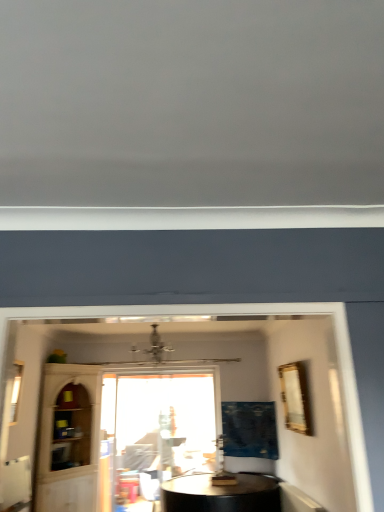
What do you see at coordinates (295, 397) in the screenshot?
I see `gold metallic picture frame at upper right` at bounding box center [295, 397].

Locate an element on the screen. transparent glass window at center, placed as the first window when sorted from bottom to top is located at coordinates (155, 432).

Identify the location of clear glass window at left, which is the second window in bottom-to-top order. (16, 390).

You are a GUI agent. You are given a task and a screenshot of the screen. Output one action in this format:
    pyautogui.click(x=<x>, y=<y>)
    Task: Click on the gold metallic picture frame at upper right
    This screenshot has width=384, height=512.
    Given the screenshot: What is the action you would take?
    pyautogui.click(x=295, y=397)

Is point (223, 442) closer or farther from the camera than point (46, 455)?

Point (223, 442) is positioned farther from the camera compared to point (46, 455).

Locate an element on the screen. curtain below the transparent glass cabinet at lower left (from the image's perspective) is located at coordinates (250, 429).

Measure the distance from blue fabric curtain at center to transparent glass cabinet at lower left.

blue fabric curtain at center and transparent glass cabinet at lower left are 2.05 meters apart.

From a real-world perspective, is blue fabric curtain at center positioned above or below transparent glass cabinet at lower left?

blue fabric curtain at center is above transparent glass cabinet at lower left.

Is blue fabric curtain at center facing towards transparent glass window at center, the second window when ordered from top to bottom?

No, blue fabric curtain at center is not aimed at transparent glass window at center, the second window when ordered from top to bottom.

Between blue fabric curtain at center and transparent glass window at center, which appears as the first window when viewed from the right, which one has larger width?

With larger width is blue fabric curtain at center.

Are blue fabric curtain at center and transparent glass window at center, placed as the first window when sorted from bottom to top, beside each other?

There is a gap between blue fabric curtain at center and transparent glass window at center, placed as the first window when sorted from bottom to top.

Consider the image. Does blue fabric curtain at center have a lesser height compared to transparent glass window at center, which appears as the first window when viewed from the right?

Indeed, blue fabric curtain at center has a lesser height compared to transparent glass window at center, which appears as the first window when viewed from the right.

From a real-world perspective, who is located lower, gold metallic picture frame at upper right or transparent glass window at center, acting as the 1th window starting from the back?

transparent glass window at center, acting as the 1th window starting from the back, is physically lower.

From the picture: Does gold metallic picture frame at upper right have a greater height compared to transparent glass window at center, the second window positioned from the front?

Incorrect, the height of gold metallic picture frame at upper right is not larger of that of transparent glass window at center, the second window positioned from the front.

Choose the correct answer: Is gold metallic picture frame at upper right inside transparent glass window at center, which appears as the first window when viewed from the right, or outside it?

gold metallic picture frame at upper right is outside transparent glass window at center, which appears as the first window when viewed from the right.

Does gold metallic picture frame at upper right have a lesser width compared to transparent glass window at center, the second window viewed from the left?

No, gold metallic picture frame at upper right is not thinner than transparent glass window at center, the second window viewed from the left.

Are transparent glass window at center, which appears as the first window when viewed from the right, and clear glass window at left, which is the 1th window from front to back, located far from each other?

transparent glass window at center, which appears as the first window when viewed from the right, is far away from clear glass window at left, which is the 1th window from front to back.

Does transparent glass window at center, the second window positioned from the front, have a larger size compared to clear glass window at left, the 2th window viewed from the right?

Yes, transparent glass window at center, the second window positioned from the front, is bigger than clear glass window at left, the 2th window viewed from the right.

In terms of width, does transparent glass window at center, which appears as the first window when viewed from the right, look wider or thinner when compared to clear glass window at left, which is the first window in left-to-right order?

In the image, transparent glass window at center, which appears as the first window when viewed from the right, appears to be more narrow than clear glass window at left, which is the first window in left-to-right order.

Considering the sizes of objects transparent glass cabinet at lower left and blue fabric curtain at center in the image provided, who is thinner, transparent glass cabinet at lower left or blue fabric curtain at center?

With smaller width is transparent glass cabinet at lower left.

Image resolution: width=384 pixels, height=512 pixels. I want to click on curtain on the right of transparent glass cabinet at lower left, so click(x=250, y=429).

Does transparent glass cabinet at lower left appear on the right side of blue fabric curtain at center?

Incorrect, transparent glass cabinet at lower left is not on the right side of blue fabric curtain at center.

Could you tell me if transparent glass window at center, placed as the first window when sorted from bottom to top, is turned towards blue fabric curtain at center?

No, transparent glass window at center, placed as the first window when sorted from bottom to top, does not turn towards blue fabric curtain at center.

Considering the points (175, 467) and (241, 406), which point is behind, point (175, 467) or point (241, 406)?

The point (175, 467) is behind.

From the image's perspective, between transparent glass window at center, which appears as the first window when viewed from the right, and gold metallic picture frame at upper right, which one is located above?

gold metallic picture frame at upper right is shown above in the image.

Is transparent glass window at center, the second window positioned from the front, far from gold metallic picture frame at upper right?

Absolutely, transparent glass window at center, the second window positioned from the front, is distant from gold metallic picture frame at upper right.

Considering the relative positions of transparent glass window at center, which appears as the first window when viewed from the right, and gold metallic picture frame at upper right in the image provided, is transparent glass window at center, which appears as the first window when viewed from the right, to the right of gold metallic picture frame at upper right from the viewer's perspective?

In fact, transparent glass window at center, which appears as the first window when viewed from the right, is to the left of gold metallic picture frame at upper right.

Could you measure the distance between transparent glass window at center, acting as the 1th window starting from the back, and gold metallic picture frame at upper right?

They are 2.19 meters apart.

Identify the location of curtain on the right of transparent glass cabinet at lower left. This screenshot has width=384, height=512. (250, 429).

Identify the location of window behind the blue fabric curtain at center. This screenshot has height=512, width=384. (155, 432).

Estimate the real-world distances between objects in this image. Which object is closer to gold metallic picture frame at upper right, blue fabric curtain at center or transparent glass window at center, which appears as the first window when viewed from the right?

The object closer to gold metallic picture frame at upper right is blue fabric curtain at center.

From the picture: Looking at the image, which one is located further to clear glass window at left, the 2th window positioned from the back, transparent glass cabinet at lower left or blue fabric curtain at center?

blue fabric curtain at center is positioned further to the anchor clear glass window at left, the 2th window positioned from the back.

Estimate the real-world distances between objects in this image. Which object is further from transparent glass window at center, placed as the first window when sorted from bottom to top, blue fabric curtain at center or clear glass window at left, the 1th window in the top-to-bottom sequence?

clear glass window at left, the 1th window in the top-to-bottom sequence, is further to transparent glass window at center, placed as the first window when sorted from bottom to top.

Consider the image. Looking at the image, which one is located closer to blue fabric curtain at center, clear glass window at left, the 2th window positioned from the back, or transparent glass window at center, which appears as the first window when viewed from the right?

transparent glass window at center, which appears as the first window when viewed from the right.

Which object lies nearer to the anchor point transparent glass cabinet at lower left, gold metallic picture frame at upper right or clear glass window at left, the 2th window viewed from the right?

gold metallic picture frame at upper right is positioned closer to the anchor transparent glass cabinet at lower left.

When comparing their distances from transparent glass window at center, acting as the 1th window starting from the back, does gold metallic picture frame at upper right or clear glass window at left, which is the first window in left-to-right order, seem further?

clear glass window at left, which is the first window in left-to-right order, lies further to transparent glass window at center, acting as the 1th window starting from the back, than the other object.

When comparing their distances from blue fabric curtain at center, does clear glass window at left, which is the first window in left-to-right order, or gold metallic picture frame at upper right seem closer?

gold metallic picture frame at upper right is positioned closer to the anchor blue fabric curtain at center.

When comparing their distances from gold metallic picture frame at upper right, does clear glass window at left, which is the first window in left-to-right order, or blue fabric curtain at center seem closer?

blue fabric curtain at center is positioned closer to the anchor gold metallic picture frame at upper right.

Find the location of `glass door between clear glass window at left, which is the first window in left-to-right order, and gold metallic picture frame at upper right, in the horizontal direction`. glass door between clear glass window at left, which is the first window in left-to-right order, and gold metallic picture frame at upper right, in the horizontal direction is located at coordinates (69, 439).

Where is `window located between transparent glass cabinet at lower left and gold metallic picture frame at upper right in the left-right direction`? The width and height of the screenshot is (384, 512). window located between transparent glass cabinet at lower left and gold metallic picture frame at upper right in the left-right direction is located at coordinates (x=155, y=432).

Where is `curtain between gold metallic picture frame at upper right and transparent glass window at center, acting as the 1th window starting from the back, from front to back`? The height and width of the screenshot is (512, 384). curtain between gold metallic picture frame at upper right and transparent glass window at center, acting as the 1th window starting from the back, from front to back is located at coordinates (250, 429).

Identify the location of curtain between clear glass window at left, the 2th window positioned from the back, and gold metallic picture frame at upper right, in the horizontal direction. (250, 429).